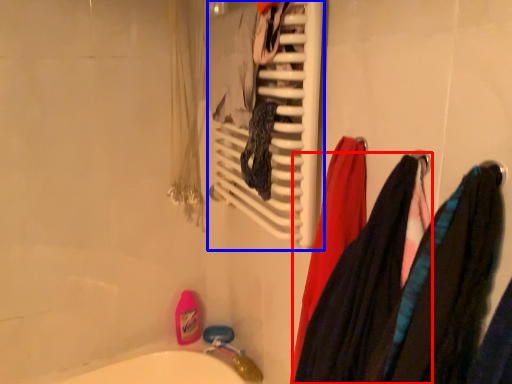
Question: Which object is further to the camera taking this photo, clothing (highlighted by a red box) or towel rack (highlighted by a blue box)?

Choices:
 (A) clothing
 (B) towel rack

Answer: (B)